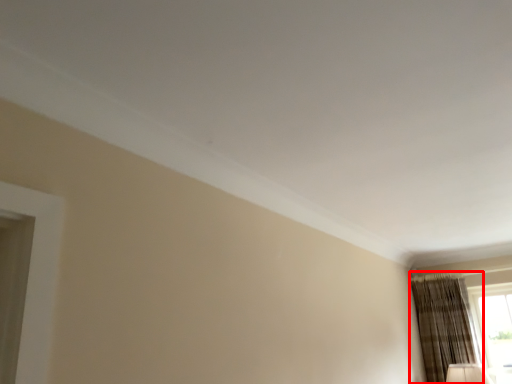
Question: From the image's perspective, where is curtain (annotated by the red box) located in relation to window in the image?

Choices:
 (A) below
 (B) above

Answer: (B)